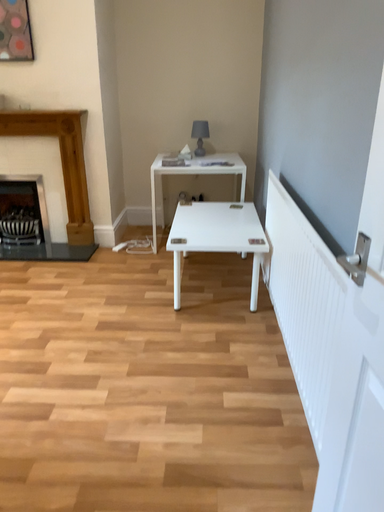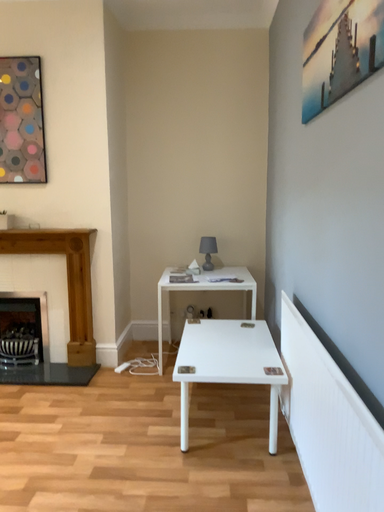
Question: How did the camera likely rotate when shooting the video?

Choices:
 (A) rotated upward
 (B) rotated downward

Answer: (A)